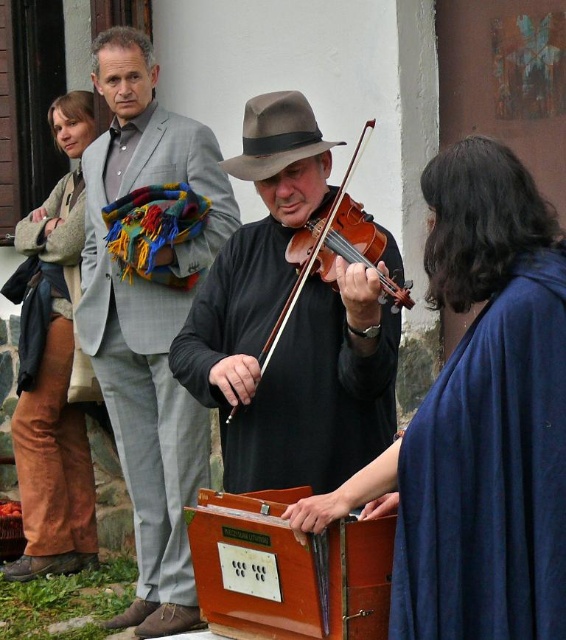
You are a photographer trying to capture the violinist and the harmonium in a single shot. Since the blue woolen shawl at center and the shiny brown violin at center are both in your frame, which object is closer to the camera?

The blue woolen shawl at center is in front of the shiny brown violin at center, so the blue woolen shawl at center is closer to the camera.

You are a photographer at the event and want to capture a photo of both the dark blue fabric dress at lower right and the brown corduroy pants at left. Based on their positions, which one should you focus on first to ensure both are in the frame?

The dark blue fabric dress at lower right is positioned on the right side of brown corduroy pants at left, so you should focus on the brown corduroy pants at left first to ensure both are in the frame.

You are organizing a small performance space and need to ensure that the blue woolen shawl at center and the shiny brown violin at center can both fit on a table that is 1.2 meters wide. Based on their sizes, will they fit together on the table?

The blue woolen shawl at center is wider than the shiny brown violin at center. However, without knowing their exact widths, it is impossible to determine if their combined width exceeds the table. Please provide more specific measurements for accurate assessment.